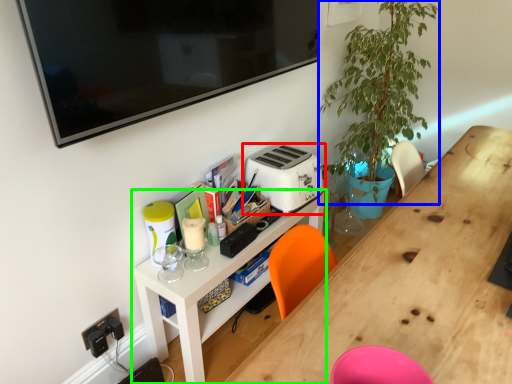
Question: Which is nearer to the toaster (highlighted by a red box)? plant (highlighted by a blue box) or shelf (highlighted by a green box).

Choices:
 (A) plant
 (B) shelf

Answer: (B)